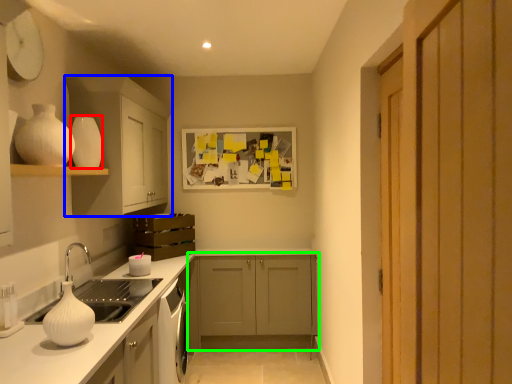
Question: Which is nearer to the vase (highlighted by a red box)? cabinetry (highlighted by a blue box) or cabinetry (highlighted by a green box).

Choices:
 (A) cabinetry
 (B) cabinetry

Answer: (A)